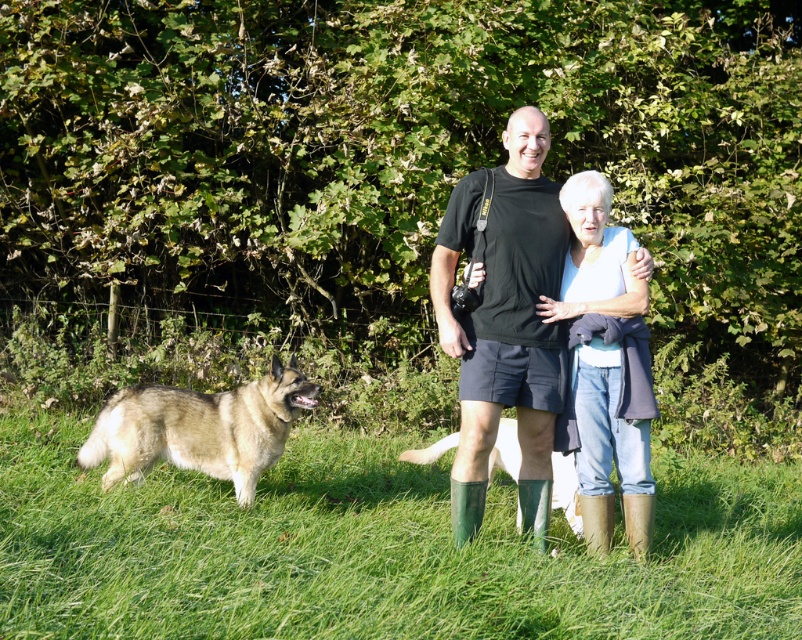
You are standing at the position of the light colored dog in the scene. You want to walk to the denim jeans at center. How many steps would you need to take if each step is about 3 feet long?

The denim jeans at center are 18.23 feet away from your current position. Since each step is 3 feet long, you would need approximately 6 steps to reach them.